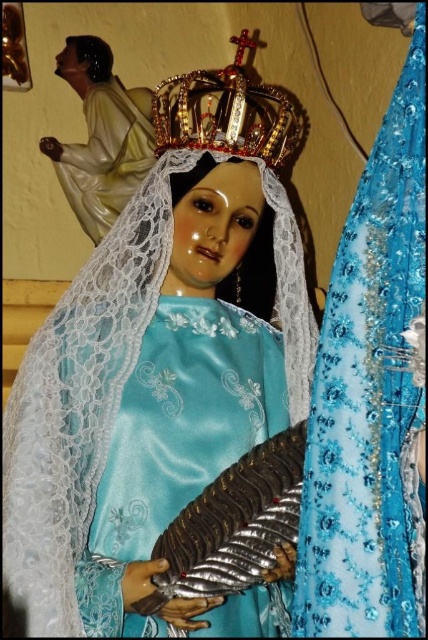
You are an art conservator measuring the spacing between the statue of the Virgin Mary and her crown. The recommended safety distance for preservation is 15 inches. Is the current distance between the satin blue dress at center and the gold jeweled crown at upper center sufficient?

The distance between the satin blue dress at center and the gold jeweled crown at upper center is 14.98 inches, which is slightly less than the recommended 15 inches. Therefore, the current spacing is insufficient and may require adjustment to meet preservation standards.